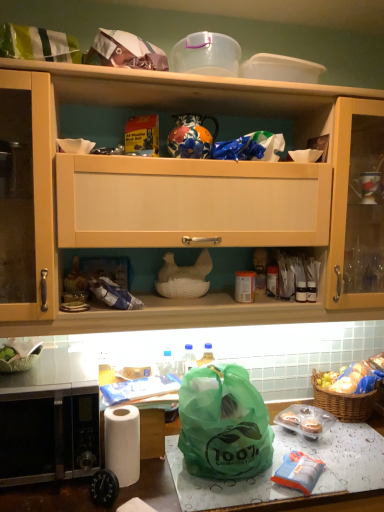
Question: Is green plastic bag at lower center thinner than translucent plastic cupcakes at lower right, the second food positioned from the top?

Choices:
 (A) yes
 (B) no

Answer: (B)

Question: Does green plastic bag at lower center have a lesser height compared to translucent plastic cupcakes at lower right, the second food positioned from the top?

Choices:
 (A) no
 (B) yes

Answer: (B)

Question: From a real-world perspective, is green plastic bag at lower center over translucent plastic cupcakes at lower right, the 2th food viewed from the front?

Choices:
 (A) yes
 (B) no

Answer: (B)

Question: Is green plastic bag at lower center looking in the opposite direction of translucent plastic cupcakes at lower right, the second food positioned from the top?

Choices:
 (A) yes
 (B) no

Answer: (B)

Question: From the image's perspective, is green plastic bag at lower center above translucent plastic cupcakes at lower right, the 2th food viewed from the front?

Choices:
 (A) no
 (B) yes

Answer: (A)

Question: Can you confirm if green plastic bag at lower center is positioned to the left of translucent plastic cupcakes at lower right, the 2th food viewed from the front?

Choices:
 (A) no
 (B) yes

Answer: (B)

Question: Is stainless steel microwave at lower left behind matte plastic bag at lower center?

Choices:
 (A) yes
 (B) no

Answer: (A)

Question: From a real-world perspective, is stainless steel microwave at lower left located beneath matte plastic bag at lower center?

Choices:
 (A) no
 (B) yes

Answer: (A)

Question: Can we say stainless steel microwave at lower left lies outside matte plastic bag at lower center?

Choices:
 (A) no
 (B) yes

Answer: (B)

Question: Considering the relative positions of stainless steel microwave at lower left and matte plastic bag at lower center in the image provided, is stainless steel microwave at lower left in front of matte plastic bag at lower center?

Choices:
 (A) yes
 (B) no

Answer: (B)

Question: From the image's perspective, would you say stainless steel microwave at lower left is positioned over matte plastic bag at lower center?

Choices:
 (A) no
 (B) yes

Answer: (B)

Question: From the image's perspective, does stainless steel microwave at lower left appear lower than matte plastic bag at lower center?

Choices:
 (A) no
 (B) yes

Answer: (A)

Question: From a real-world perspective, is translucent plastic cupcakes at lower right, the second food when ordered from back to front, under transparent plastic container at upper center?

Choices:
 (A) yes
 (B) no

Answer: (A)